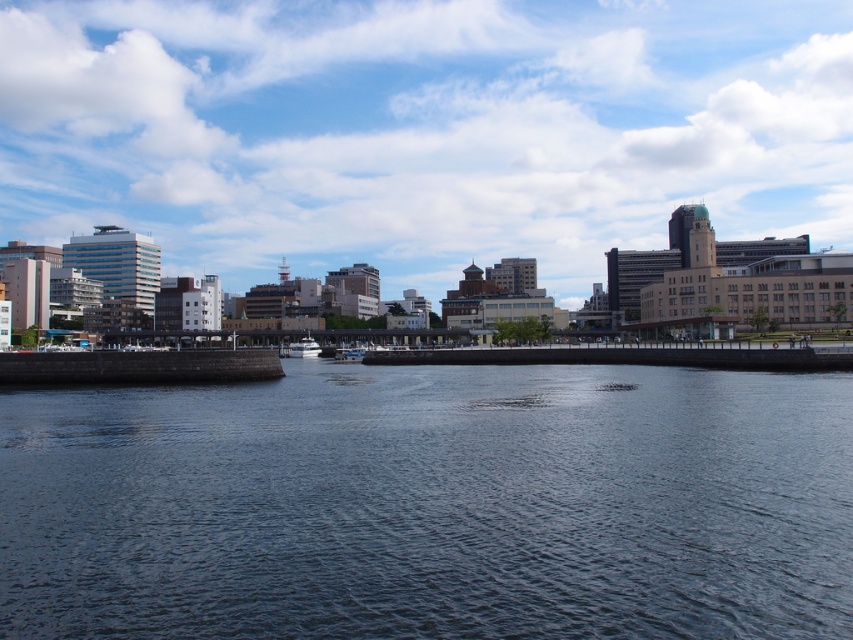
You are standing at the point closer to the water in the urban waterfront scene. There are two points marked in the image, one at point [109,164] and the other at point [310,339]. Which point is farther away from you?

Point [109,164] is behind point [310,339], so the point farther away from you is point [109,164].

You are standing at the edge of the waterfront scene described, and you want to know the distance between the dark gray water at center and the blue sky at upper center. Can you estimate how far apart they are?

The dark gray water at center is 296.23 meters away from the blue sky at upper center.